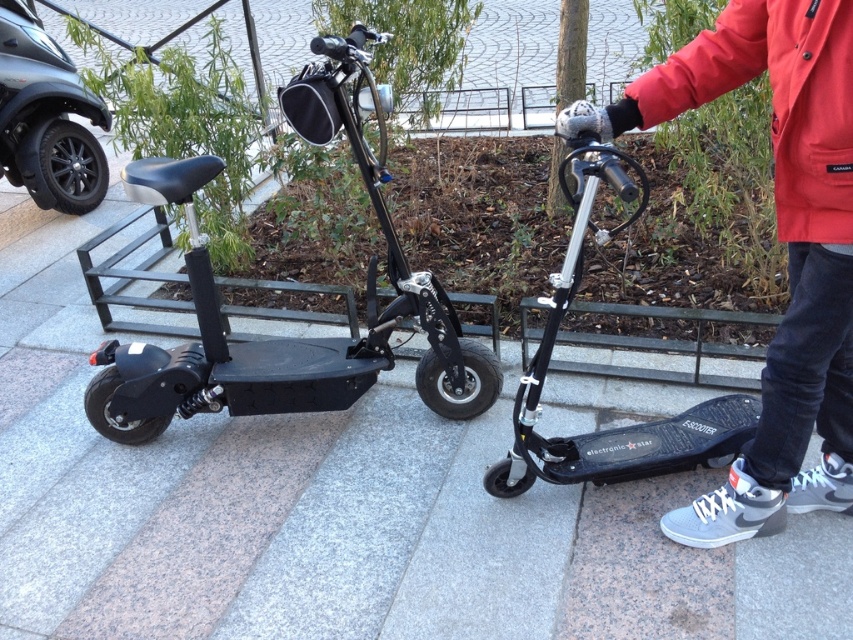
You are a delivery person who needs to pick up a jacket from the scene. The jacket is hanging on a hook near the black matte scooter at left. Can you confirm if the gray fabric jacket at upper right is the one you need to deliver?

The gray fabric jacket at upper right is to the right of the black matte scooter at left, so it is likely the jacket hanging near the scooter. Yes, you should deliver the gray fabric jacket at upper right.

You are standing at the point marked as point (780, 241). Looking around, you see two electric scooters parked side by side. Which object is directly in front of you?

The point (780, 241) is on gray fabric jacket at upper right, so the gray fabric jacket at upper right is directly in front of you.

You are a delivery person needing to quickly reach a nearby delivery point. You see the black matte scooter at left and the red waterproof jacket at upper right. Which item is closer to your current position if you are standing to the right of both items?

The black matte scooter at left is closer to your current position because it is positioned to the left of the red waterproof jacket at upper right, so when standing to the right of both, the scooter would be nearer.